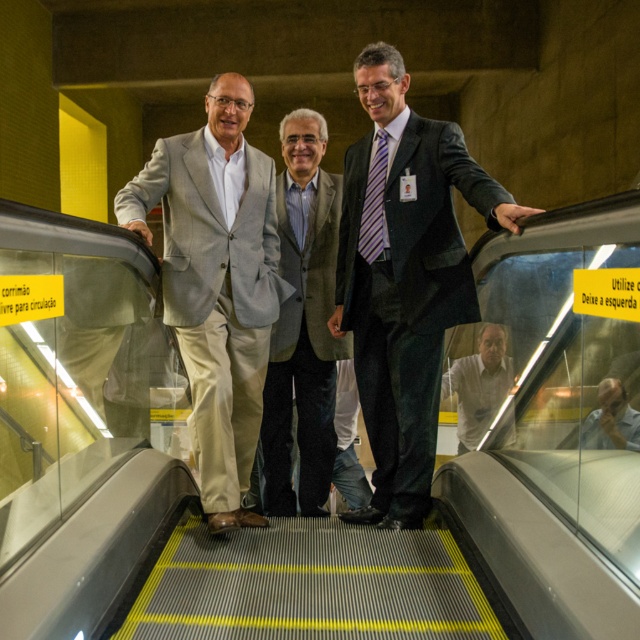
Does light brown textured suit at center have a greater width compared to white glossy shirt at center?

Correct, the width of light brown textured suit at center exceeds that of white glossy shirt at center.

Does point (284, 339) lie behind point (449, 392)?

No, (284, 339) is closer to viewer.

Where is `light brown textured suit at center`? light brown textured suit at center is located at coordinates (301, 324).

From the picture: Is white glossy shirt at center taller than matte black shirt at center?

Indeed, white glossy shirt at center has a greater height compared to matte black shirt at center.

Does white glossy shirt at center appear over matte black shirt at center?

Incorrect, white glossy shirt at center is not positioned above matte black shirt at center.

The height and width of the screenshot is (640, 640). I want to click on white glossy shirt at center, so click(x=480, y=385).

The height and width of the screenshot is (640, 640). In order to click on white glossy shirt at center in this screenshot , I will do `click(480, 385)`.

Which is above, light gray suit at center or white glossy shirt at center?

light gray suit at center

Does point (193, 172) come farther from viewer compared to point (468, 376)?

No.

Where is `light gray suit at center`? The height and width of the screenshot is (640, 640). light gray suit at center is located at coordinates (216, 284).